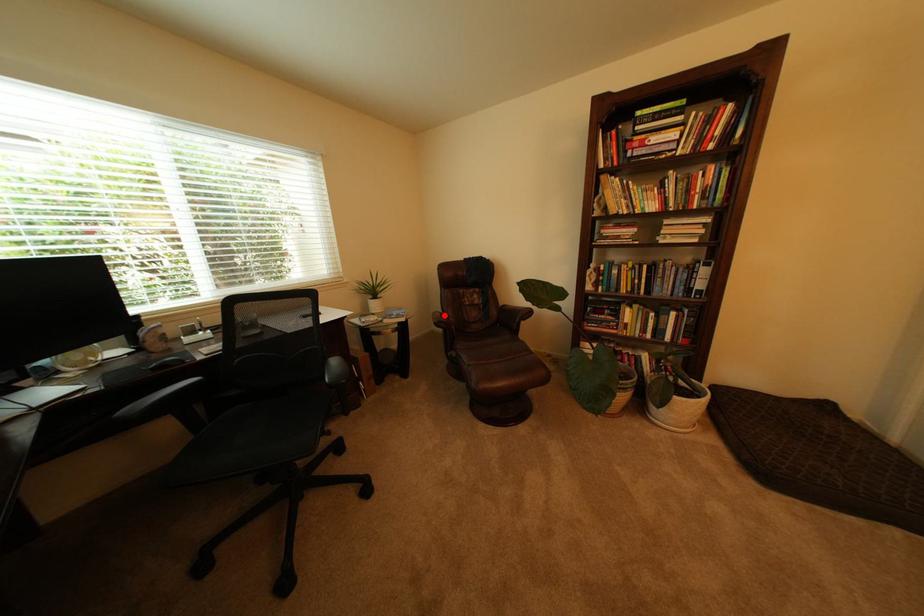
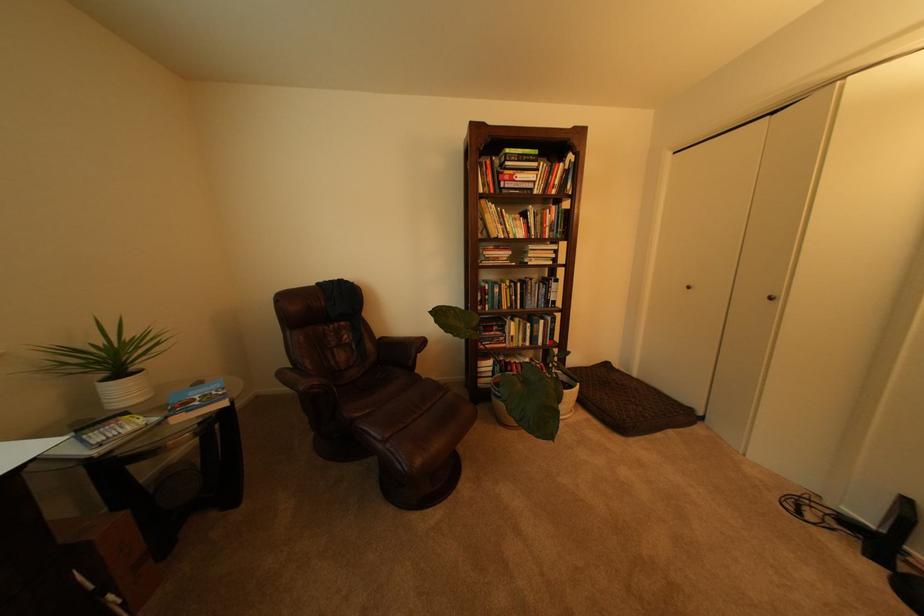
The point at the highlighted location is marked in the first image. Where is the corresponding point in the second image?

(290, 374)